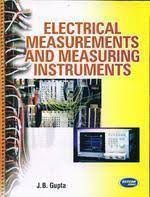
Where is `book`? book is located at coordinates (59, 141).